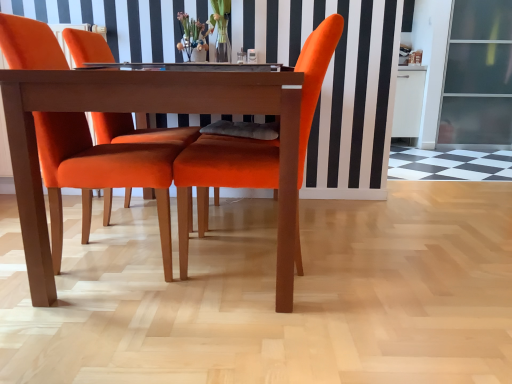
Question: From the image's perspective, is translucent glass vase at center positioned above or below velvet orange chair at center, arranged as the second chair when viewed from the right?

Choices:
 (A) above
 (B) below

Answer: (A)

Question: In the image, is translucent glass vase at center on the left side or the right side of velvet orange chair at center, placed as the 1th chair when sorted from left to right?

Choices:
 (A) right
 (B) left

Answer: (A)

Question: Considering the real-world distances, which object is farthest from the translucent glass vase at center?

Choices:
 (A) transparent glass screen door at right
 (B) velvet orange chair at center, positioned as the first chair in right-to-left order
 (C) clear glass table at center
 (D) wooden table at center
 (E) velvet orange chair at center, arranged as the second chair when viewed from the right

Answer: (A)

Question: Based on their relative distances, which object is farther from the wooden table at center?

Choices:
 (A) clear glass table at center
 (B) velvet orange chair at center, which is counted as the 2th chair, starting from the left
 (C) velvet orange chair at center, arranged as the second chair when viewed from the right
 (D) transparent glass screen door at right
 (E) translucent glass vase at center

Answer: (D)